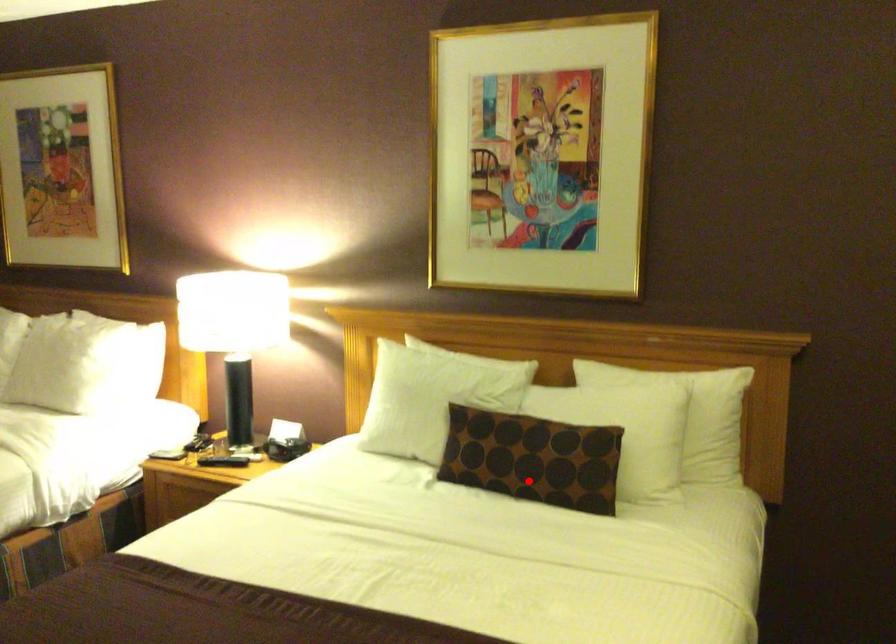
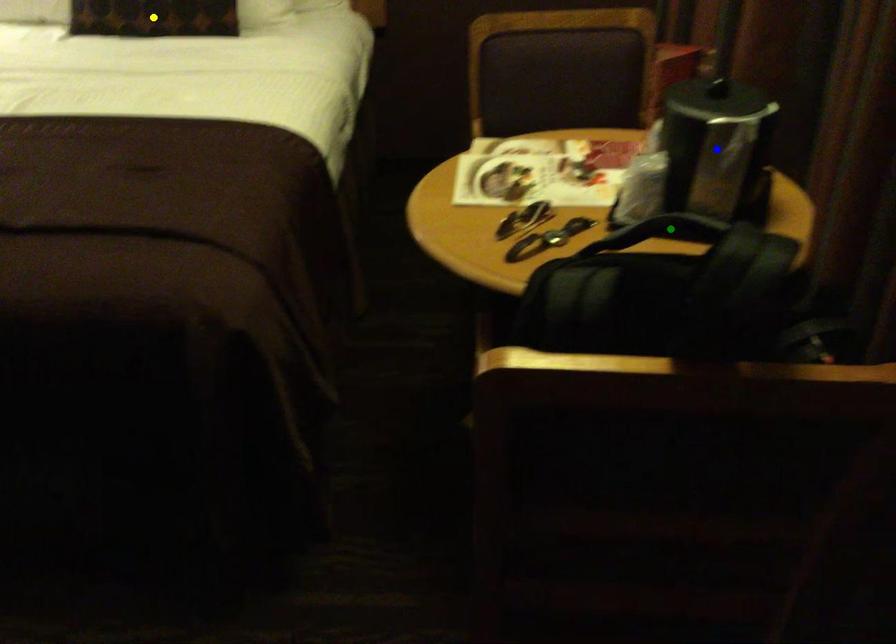
Question: I am providing you with two images of the same scene from different viewpoints. A red point is marked on the first image. You are given multiple points on the second image. In image 2, which mark is for the same physical point as the one in image 1?

Choices:
 (A) green point
 (B) yellow point
 (C) blue point

Answer: (B)